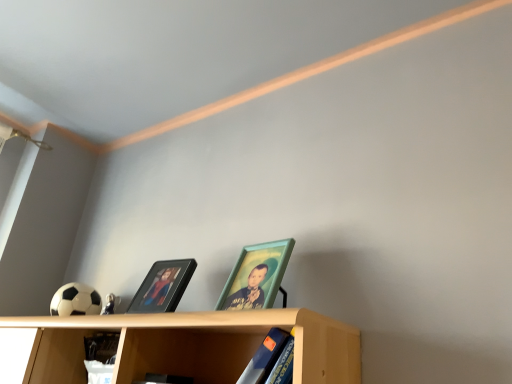
Question: From a real-world perspective, is black glossy picture frame at center, marked as the first picture frame in a left-to-right arrangement, beneath blue matte book at lower center?

Choices:
 (A) no
 (B) yes

Answer: (A)

Question: Does black glossy picture frame at center, marked as the first picture frame in a left-to-right arrangement, have a smaller size compared to blue matte book at lower center?

Choices:
 (A) no
 (B) yes

Answer: (B)

Question: Can we say black glossy picture frame at center, the 2th picture frame viewed from the right, lies outside blue matte book at lower center?

Choices:
 (A) yes
 (B) no

Answer: (A)

Question: From a real-world perspective, is black glossy picture frame at center, the 2th picture frame viewed from the right, positioned over blue matte book at lower center based on gravity?

Choices:
 (A) yes
 (B) no

Answer: (A)

Question: Does black glossy picture frame at center, marked as the first picture frame in a left-to-right arrangement, have a lesser width compared to blue matte book at lower center?

Choices:
 (A) yes
 (B) no

Answer: (A)

Question: Considering the relative sizes of black glossy picture frame at center, the 2th picture frame viewed from the right, and blue matte book at lower center in the image provided, is black glossy picture frame at center, the 2th picture frame viewed from the right, bigger than blue matte book at lower center?

Choices:
 (A) yes
 (B) no

Answer: (B)

Question: Does teal wooden picture frame at center, the first picture frame from the right, have a greater height compared to light wood shelf at lower center?

Choices:
 (A) yes
 (B) no

Answer: (B)

Question: Can you confirm if teal wooden picture frame at center, positioned as the 2th picture frame in left-to-right order, is wider than light wood shelf at lower center?

Choices:
 (A) no
 (B) yes

Answer: (A)

Question: Is teal wooden picture frame at center, positioned as the 2th picture frame in left-to-right order, shorter than light wood shelf at lower center?

Choices:
 (A) no
 (B) yes

Answer: (B)

Question: Can you confirm if teal wooden picture frame at center, positioned as the 2th picture frame in left-to-right order, is smaller than light wood shelf at lower center?

Choices:
 (A) no
 (B) yes

Answer: (B)

Question: Is teal wooden picture frame at center, positioned as the 2th picture frame in left-to-right order, outside of light wood shelf at lower center?

Choices:
 (A) no
 (B) yes

Answer: (B)

Question: Is teal wooden picture frame at center, positioned as the 2th picture frame in left-to-right order, oriented away from light wood shelf at lower center?

Choices:
 (A) no
 (B) yes

Answer: (A)

Question: From a real-world perspective, is blue matte book at lower center positioned under light wood shelf at lower center based on gravity?

Choices:
 (A) yes
 (B) no

Answer: (A)